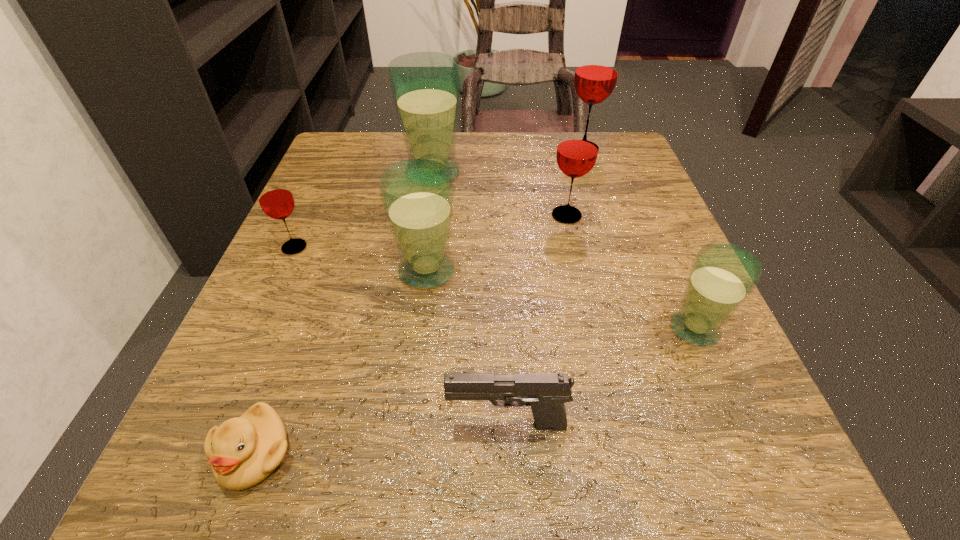
The image size is (960, 540). I want to click on blue glass that can be found as the second closest to the nearest glass, so click(x=425, y=86).

You are a GUI agent. You are given a task and a screenshot of the screen. Output one action in this format:
    pyautogui.click(x=<x>, y=<y>)
    Task: Click on the free location that satisfies the following two spatial constraints: 1. aim along the barrel of the seventh tallest object; 2. on the front-facing side of the shortest object
    Image resolution: width=960 pixels, height=540 pixels.
    Given the screenshot: What is the action you would take?
    pyautogui.click(x=509, y=453)